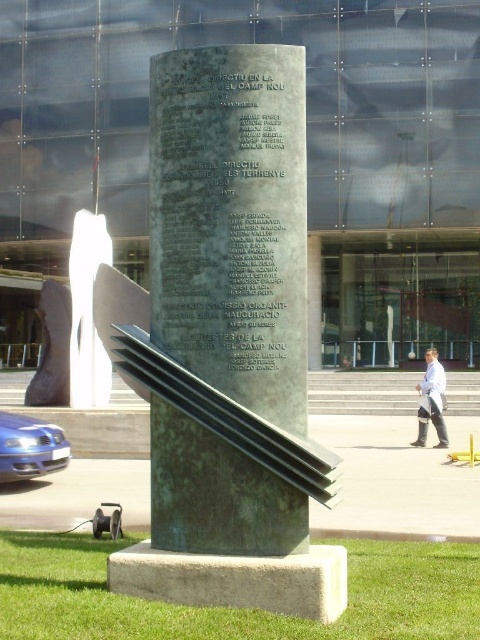
Is the position of blue metallic car at lower left more distant than that of white lab coat at center?

No, blue metallic car at lower left is in front of white lab coat at center.

Which is in front, point (8, 426) or point (427, 408)?

Point (8, 426) is more forward.

Identify the location of blue metallic car at lower left. Image resolution: width=480 pixels, height=640 pixels. (29, 448).

Can you confirm if matte bronze statue at center is taller than white lab coat at center?

Indeed, matte bronze statue at center has a greater height compared to white lab coat at center.

Is matte bronze statue at center positioned in front of white lab coat at center?

Yes.

Locate an element on the screen. The height and width of the screenshot is (640, 480). matte bronze statue at center is located at coordinates (51, 348).

Can you confirm if matte bronze statue at center is positioned below blue metallic car at lower left?

Incorrect, matte bronze statue at center is not positioned below blue metallic car at lower left.

Based on the photo, does matte bronze statue at center have a smaller size compared to blue metallic car at lower left?

Actually, matte bronze statue at center might be larger than blue metallic car at lower left.

Locate an element on the screen. The width and height of the screenshot is (480, 640). matte bronze statue at center is located at coordinates (51, 348).